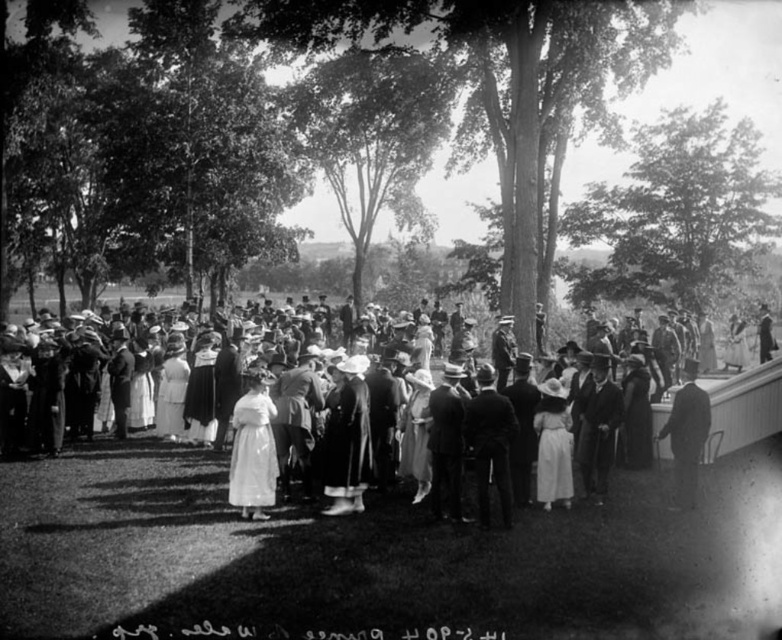
You are a photographer at the event and want to capture both the white cotton dress at center and the smooth black suit at right in a single photo. Your camera has a maximum focus range of 4 meters. Can you include both subjects in the same frame without moving the camera?

The white cotton dress at center is 4.13 meters away from the smooth black suit at right. Since the distance between them exceeds the camera maximum focus range of 4 meters, you cannot include both subjects in the same frame without moving the camera.

You are a photographer at the event and want to capture a photo that includes both the white cotton dress at center and the smooth black suit at right. Which object will appear larger in the photo?

The white cotton dress at center will appear larger in the photo because it is closer to the viewer than the smooth black suit at right.